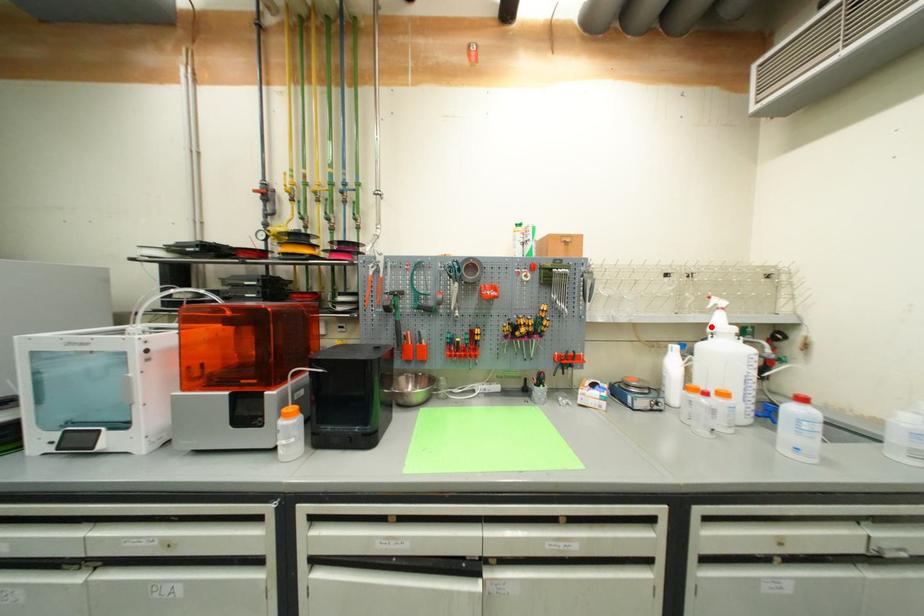
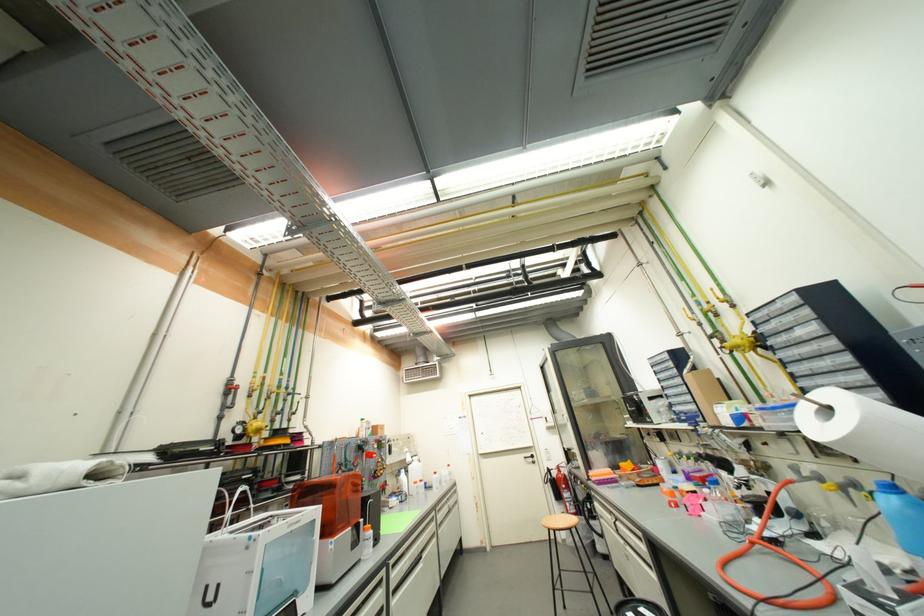
Question: I am providing you with two images of the same scene from different viewpoints. Image1 has a red point marked. In image2, the corresponding 3D location appears at what relative position? Reply with the corresponding letter.

Choices:
 (A) Closer
 (B) Farther

Answer: (B)